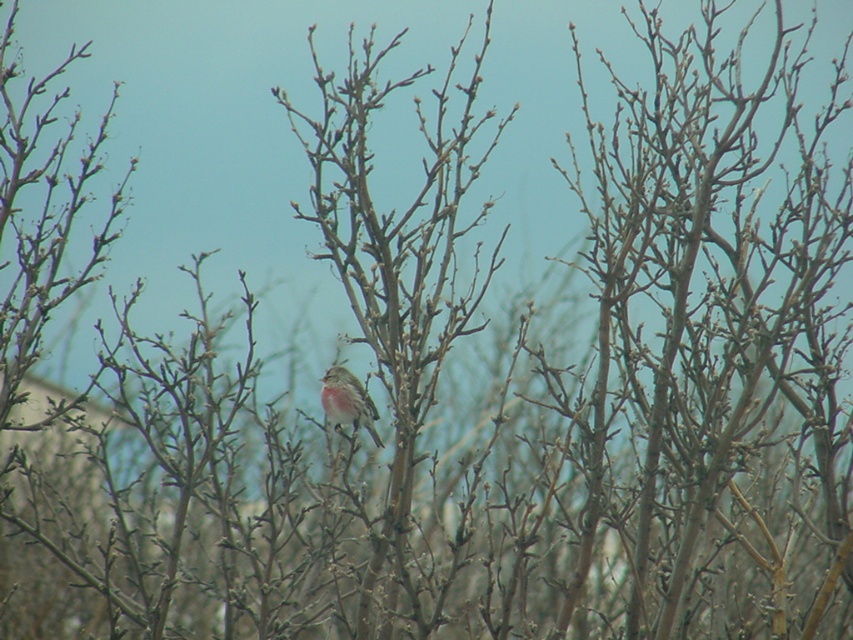
Question: Which point is farther to the camera?

Choices:
 (A) 328,420
 (B) 401,316

Answer: (A)

Question: Which of the following is the farthest from the observer?

Choices:
 (A) (334, 412)
 (B) (395, 532)

Answer: (A)

Question: Is smooth brown branches at center positioned at the back of brown speckled sparrow at center?

Choices:
 (A) no
 (B) yes

Answer: (A)

Question: Is smooth brown branches at center closer to camera compared to brown speckled sparrow at center?

Choices:
 (A) yes
 (B) no

Answer: (A)

Question: Among these objects, which one is farthest from the camera?

Choices:
 (A) smooth brown branches at center
 (B) brown speckled sparrow at center

Answer: (B)

Question: Is smooth brown branches at center below brown speckled sparrow at center?

Choices:
 (A) no
 (B) yes

Answer: (A)